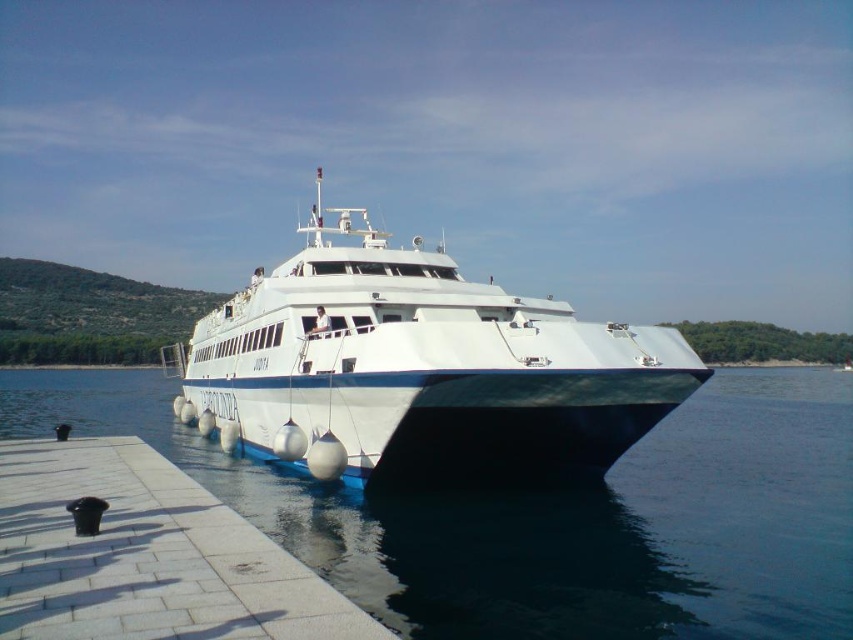
Based on the photo, does clear blue water at center have a lesser width compared to white glossy boat at center?

No.

I want to click on clear blue water at center, so click(552, 516).

Find the location of a particular element. clear blue water at center is located at coordinates (552, 516).

Is white glossy boat at center in front of white tile dock at lower left?

No, it is behind white tile dock at lower left.

Which of these two, white glossy boat at center or white tile dock at lower left, stands taller?

With more height is white glossy boat at center.

Who is more forward, (672,349) or (178,548)?

Positioned in front is point (178,548).

Image resolution: width=853 pixels, height=640 pixels. In order to click on white glossy boat at center in this screenshot , I will do `click(421, 369)`.

Between clear blue water at center and white tile dock at lower left, which one appears on the right side from the viewer's perspective?

clear blue water at center is more to the right.

Who is taller, clear blue water at center or white tile dock at lower left?

clear blue water at center is taller.

Is point (492, 525) positioned after point (67, 589)?

Yes, it is.

Find the location of a particular element. clear blue water at center is located at coordinates (552, 516).